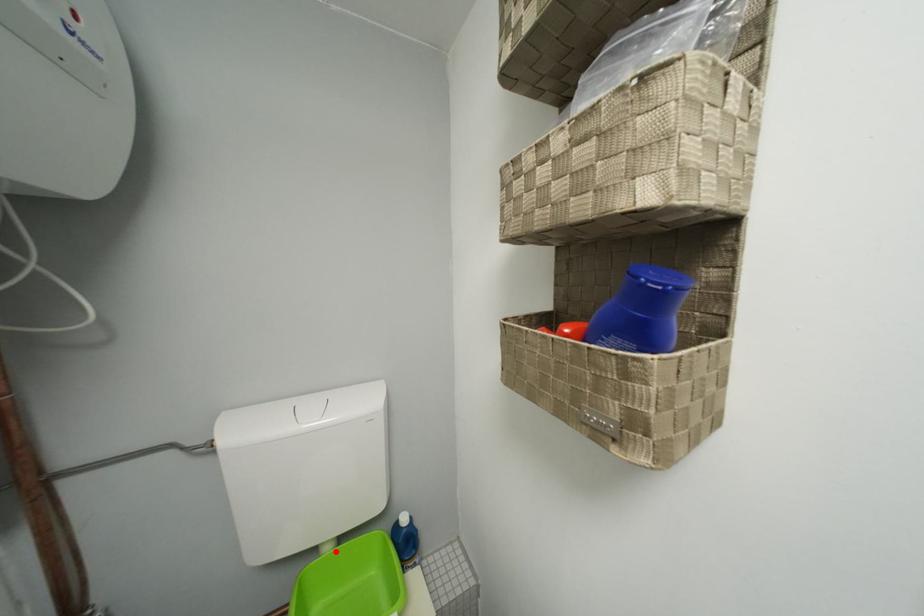
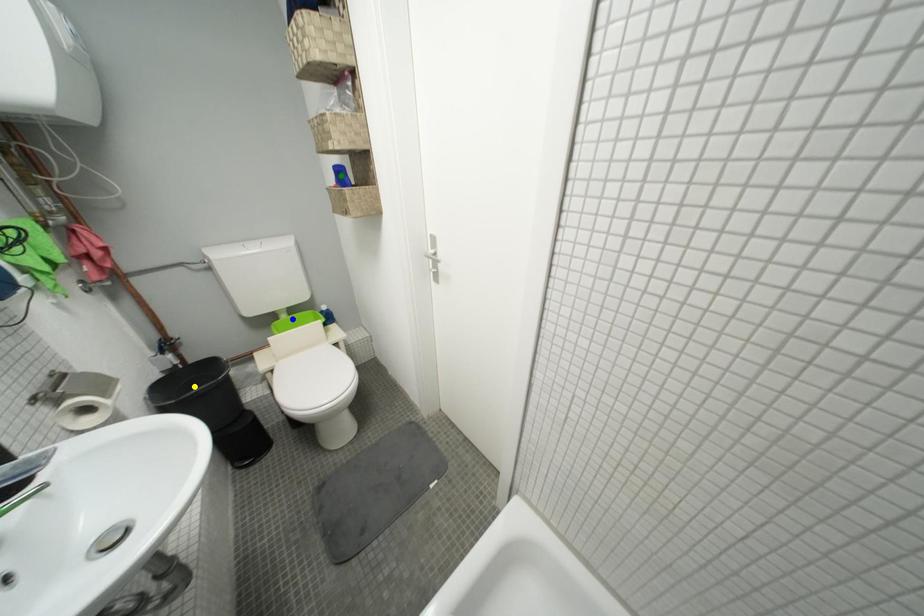
Question: I am providing you with two images of the same scene from different viewpoints. A red point is marked on the first image. You are given multiple points on the second image. Which mark in image 2 goes with the point in image 1?

Choices:
 (A) yellow point
 (B) green point
 (C) blue point

Answer: (C)